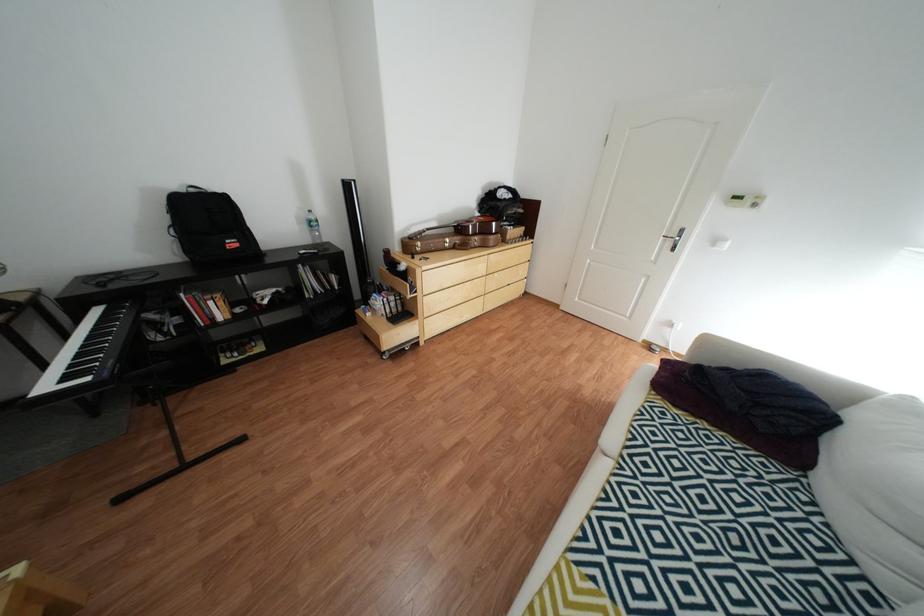
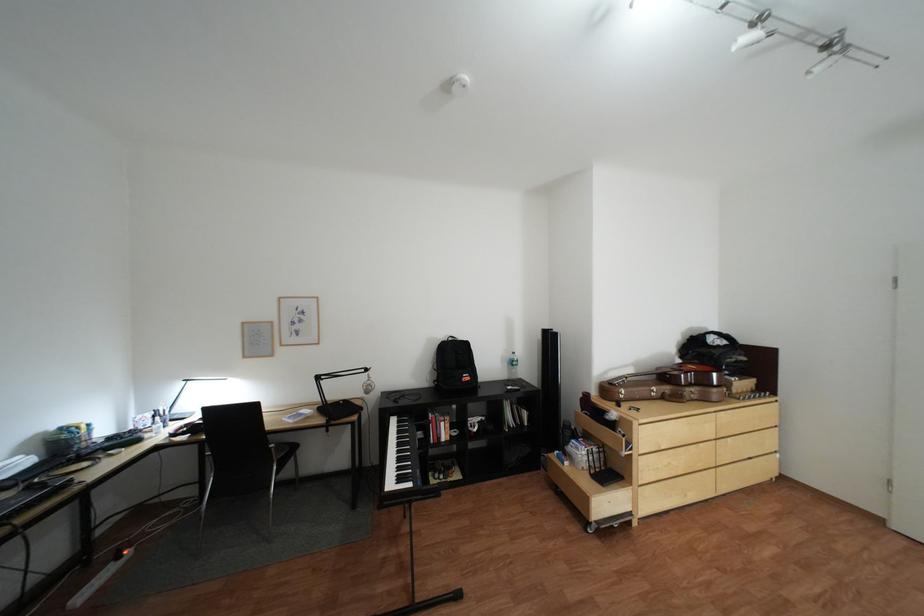
Locate, in the second image, the point that corresponds to (208,191) in the first image.

(466, 339)